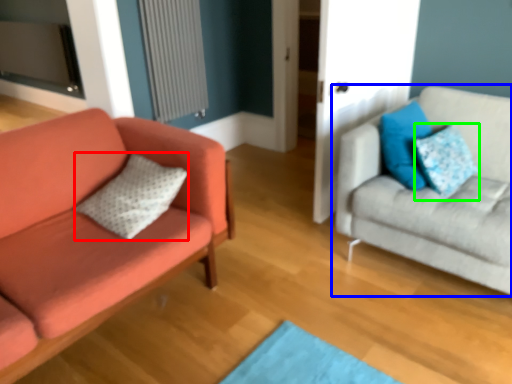
Question: Considering the real-world distances, which object is closest to pillow (highlighted by a red box)? studio couch (highlighted by a blue box) or pillow (highlighted by a green box).

Choices:
 (A) studio couch
 (B) pillow

Answer: (A)